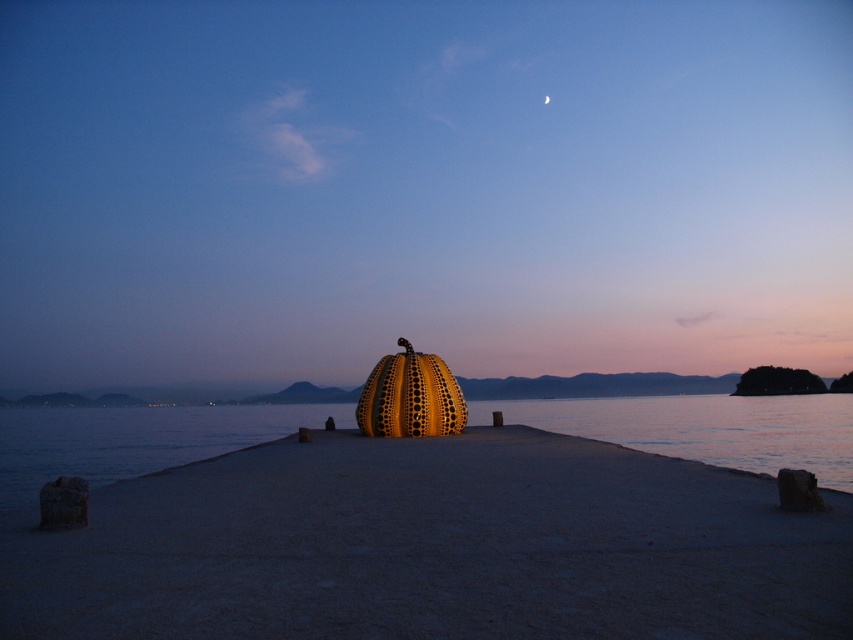
Can you confirm if smooth concrete dock at center is shorter than silver metallic crescent moon at upper center?

Correct, smooth concrete dock at center is not as tall as silver metallic crescent moon at upper center.

Is point (178, 600) closer to camera compared to point (547, 100)?

Yes, point (178, 600) is closer to viewer.

Find the location of a particular element. This screenshot has height=640, width=853. smooth concrete dock at center is located at coordinates (433, 547).

Does point (312, 404) come farther from viewer compared to point (548, 97)?

No, it is not.

Is point (94, 422) positioned in front of point (544, 99)?

Yes, it is.

Measure the distance between point (x=746, y=458) and camera.

Point (x=746, y=458) and camera are 29.13 meters apart.

Locate an element on the screen. The width and height of the screenshot is (853, 640). transparent water at center is located at coordinates click(705, 428).

How distant is smooth concrete dock at center from transparent water at center?

120.13 feet

Is smooth concrete dock at center below transparent water at center?

Incorrect, smooth concrete dock at center is not positioned below transparent water at center.

I want to click on smooth concrete dock at center, so click(x=433, y=547).

At what (x,y) coordinates should I click in order to perform the action: click on smooth concrete dock at center. Please return your answer as a coordinate pair (x, y). Image resolution: width=853 pixels, height=640 pixels. Looking at the image, I should click on (433, 547).